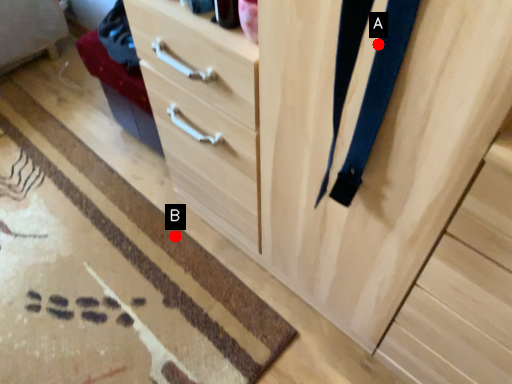
Question: Two points are circled on the image, labeled by A and B beside each circle. Which point is closer to the camera taking this photo?

Choices:
 (A) A is closer
 (B) B is closer

Answer: (A)